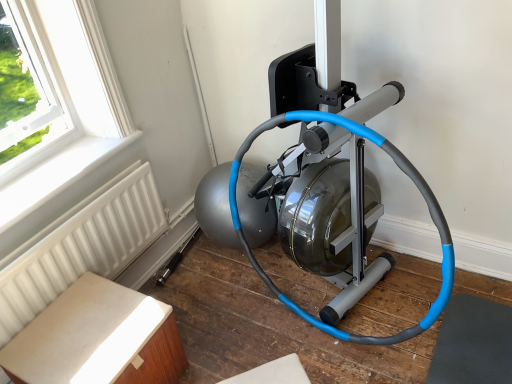
Where is `free spot to the right of blue rubber garden hose at center`? free spot to the right of blue rubber garden hose at center is located at coordinates (428, 310).